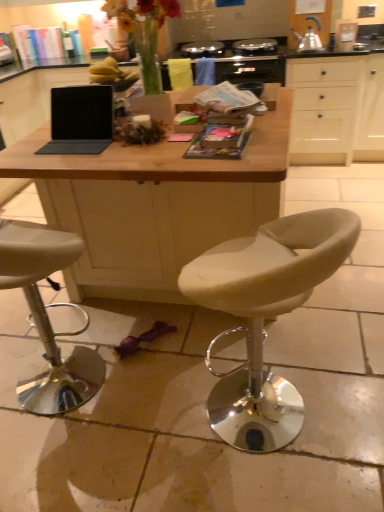
Image resolution: width=384 pixels, height=512 pixels. I want to click on free space underneath beige leather stool at lower left, the first chair from the left (from a real-world perspective), so click(52, 394).